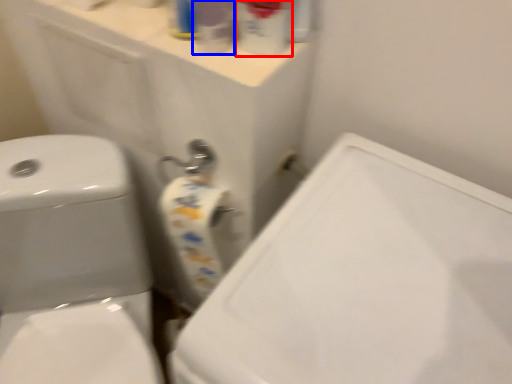
Question: Which object is further to the camera taking this photo, cleaning product (highlighted by a red box) or cleaning product (highlighted by a blue box)?

Choices:
 (A) cleaning product
 (B) cleaning product

Answer: (B)